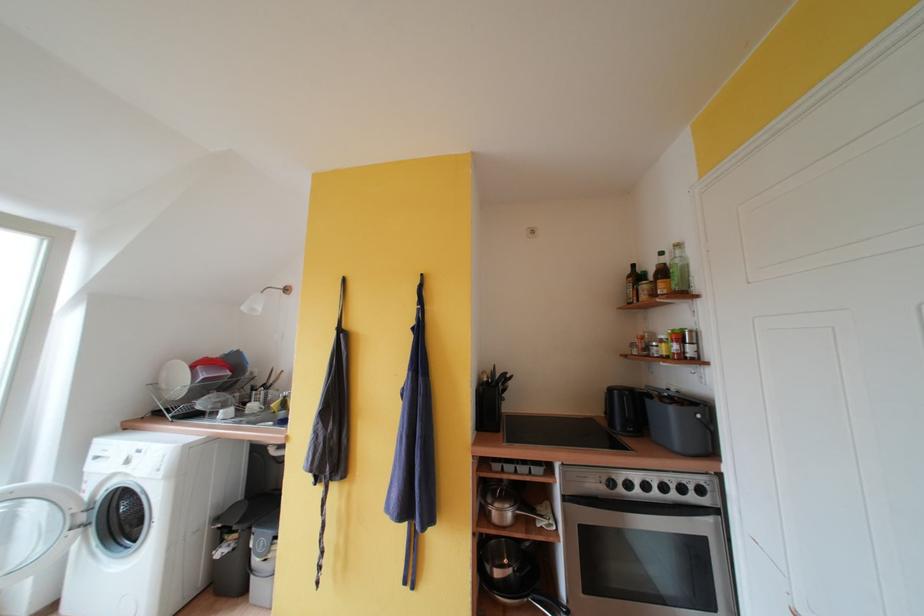
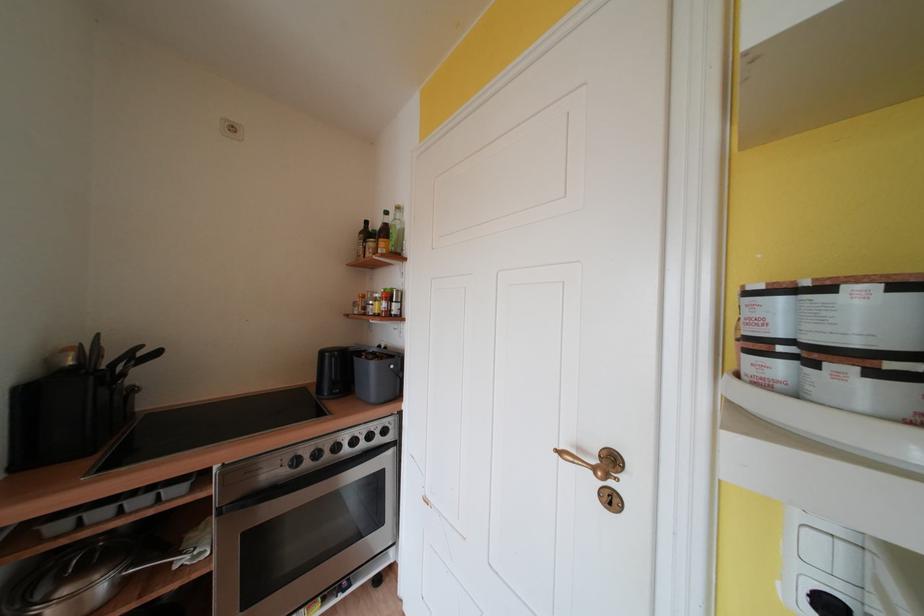
Question: The camera is either moving clockwise (left) or counter-clockwise (right) around the object. The first image is from the beginning of the video and the second image is from the end. Is the camera moving left or right when shooting the video?

Choices:
 (A) Left
 (B) Right

Answer: (A)